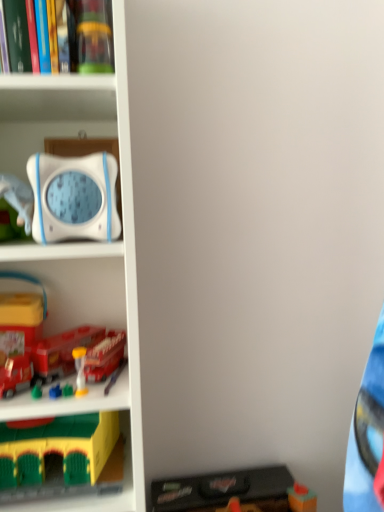
Question: In the image, is black plastic toy at lower right, marked as the 1th toy in a right-to-left arrangement, positioned in front of or behind yellow plastic building block at lower left, which is the 1th toy from left to right?

Choices:
 (A) front
 (B) behind

Answer: (B)

Question: From the image's perspective, is black plastic toy at lower right, the fourth toy viewed from the top, positioned above or below yellow plastic building block at lower left, which is counted as the fourth toy, starting from the right?

Choices:
 (A) below
 (B) above

Answer: (A)

Question: Based on their relative distances, which object is nearer to the yellow plastic building block at lower left, which is counted as the second toy, starting from the bottom?

Choices:
 (A) hardcover book at upper left
 (B) metallic red bus at lower left, the third toy when ordered from left to right
 (C) black plastic toy at lower right, which is counted as the first toy, starting from the bottom
 (D) white plastic bookcase at left
 (E) translucent plastic hourglass at lower left, which appears as the 3th toy when viewed from the right

Answer: (E)

Question: Estimate the real-world distances between objects in this image. Which object is closer to the white plastic bookcase at left?

Choices:
 (A) hardcover book at upper left
 (B) metallic red bus at lower left, the third toy when ordered from left to right
 (C) black plastic toy at lower right, the 4th toy viewed from the left
 (D) translucent plastic hourglass at lower left, marked as the 2th toy in a left-to-right arrangement
 (E) yellow plastic building block at lower left, which is counted as the second toy, starting from the bottom

Answer: (B)